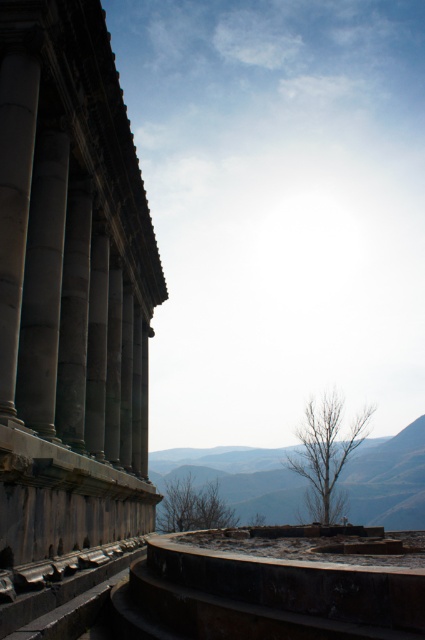
Question: Which point is farther from the camera taking this photo?

Choices:
 (A) (252, 499)
 (B) (8, 262)
 (C) (25, 388)

Answer: (A)

Question: Can you confirm if slate gray stone column at left is smaller than smooth stone column at left?

Choices:
 (A) yes
 (B) no

Answer: (B)

Question: Can you confirm if gray stone mountain at center is thinner than slate gray stone column at left?

Choices:
 (A) no
 (B) yes

Answer: (A)

Question: Does gray stone columns at left come behind smooth stone column at left?

Choices:
 (A) yes
 (B) no

Answer: (B)

Question: Which object appears farthest from the camera in this image?

Choices:
 (A) slate gray stone column at left
 (B) smooth stone column at left
 (C) gray stone mountain at center
 (D) gray stone columns at left

Answer: (C)

Question: Which object is farther from the camera taking this photo?

Choices:
 (A) gray stone columns at left
 (B) slate gray stone column at left
 (C) gray stone mountain at center

Answer: (C)